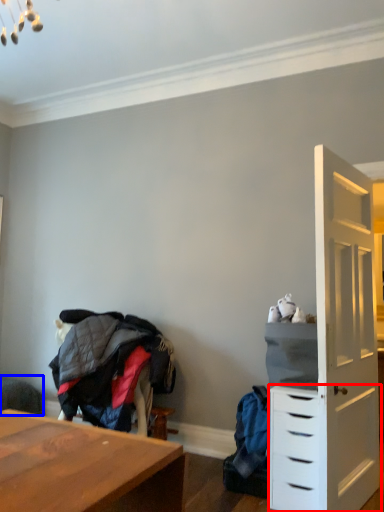
Question: Which object appears farthest to the camera in this image, chest of drawers (highlighted by a red box) or swivel chair (highlighted by a blue box)?

Choices:
 (A) chest of drawers
 (B) swivel chair

Answer: (B)